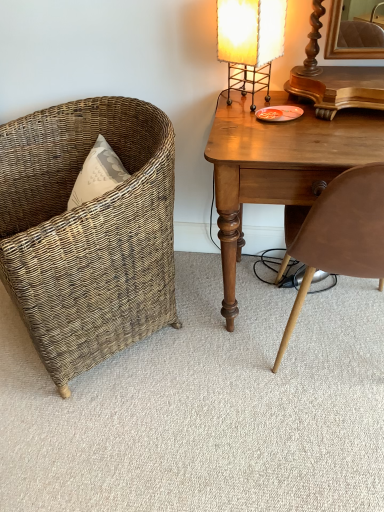
In order to click on free space to the left of brown leather chair at right, the first chair when ordered from right to left in this screenshot , I will do `click(223, 371)`.